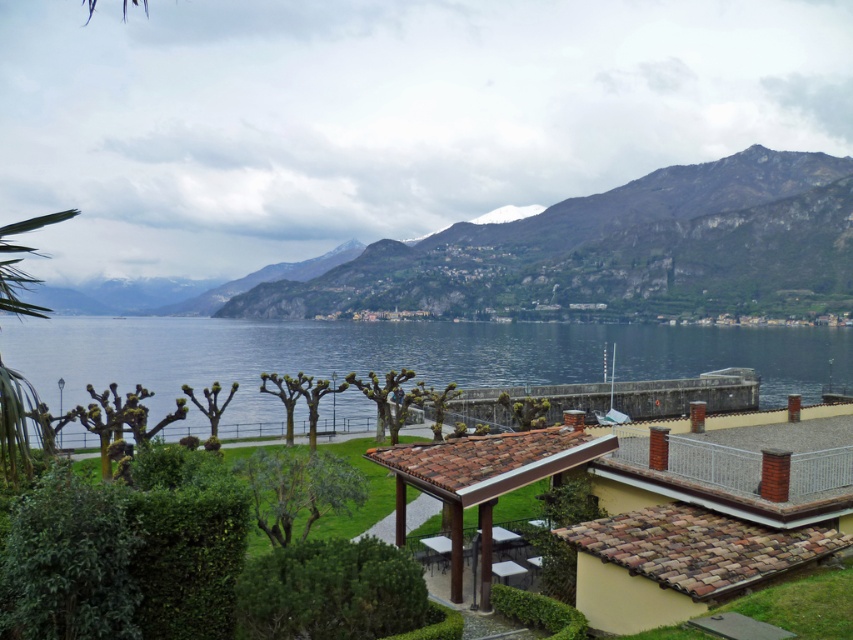
Who is more forward, (476, 308) or (680, 337)?

Point (680, 337) is more forward.

How much distance is there between green rocky mountain at upper center and blue water at center?

green rocky mountain at upper center and blue water at center are 79.77 meters apart.

Find the location of `green rocky mountain at upper center`. green rocky mountain at upper center is located at coordinates (601, 248).

Find the location of a particular element. The height and width of the screenshot is (640, 853). green rocky mountain at upper center is located at coordinates (601, 248).